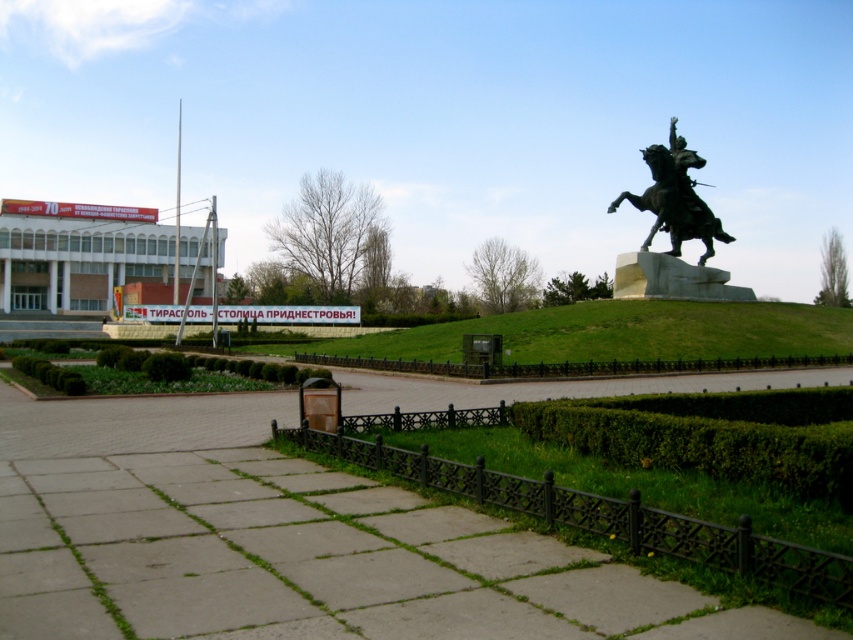
You are standing in the public square and want to take a photo of both the green leafy hedge at lower right and the bronze metallic horse at upper right. Which object should you position to your left to capture both in the frame?

The green leafy hedge at lower right is positioned on the left side of bronze metallic horse at upper right, so you should position the green leafy hedge at lower right to your left to capture both in the frame.

You are a gardener planning to trim the green leafy hedge at lower right and the bronze metallic horse at upper right. Which object requires more time to maintain due to its size?

The bronze metallic horse at upper right requires more time to maintain since it has a greater width than the green leafy hedge at lower right.

Based on the scene description, where is the green leafy hedge at lower right located in terms of coordinates?

The green leafy hedge at lower right is located at coordinates point [712,435].